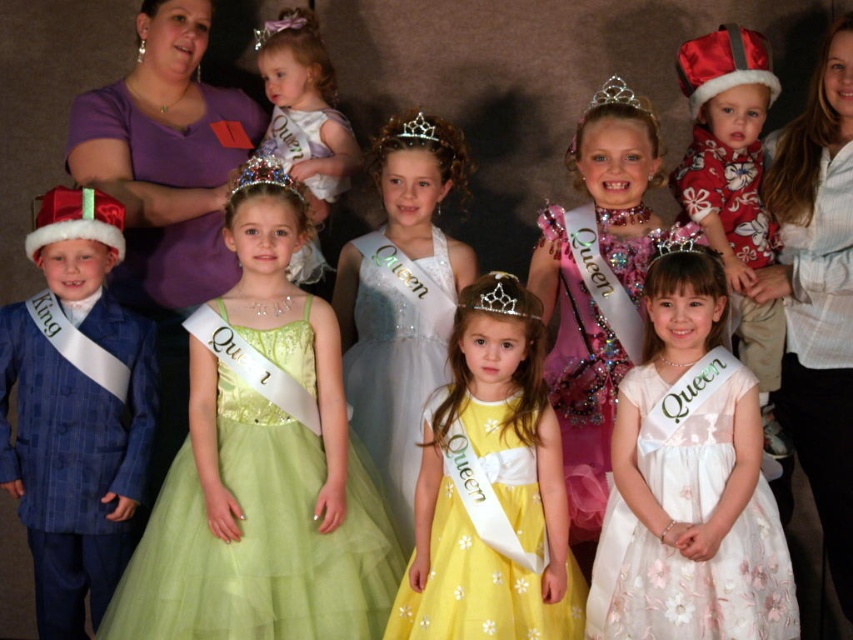
You are standing in front of the image of children in a pageant. There is a point at coordinate point (706, 596). If you want to touch this point with a stick that is 1.50 meters long, can you reach it?

The point (706, 596) is 2.00 meters away from the viewer. Since the stick is only 1.50 meters long, you cannot reach it.

In the image of children in a pageant, there is a white floral dress at center and a white striped shirt at upper right. Which clothing item is located more to the left?

The white floral dress at center is positioned more to the left side of the white striped shirt at upper right.